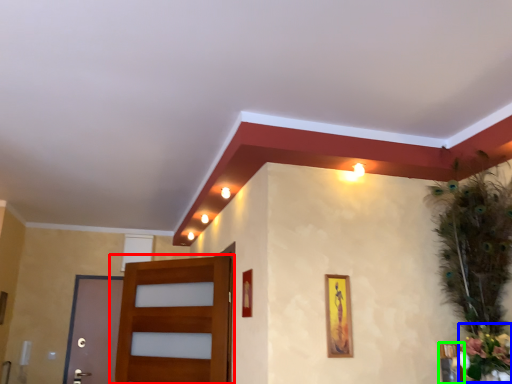
Question: Which is nearer to the door (highlighted by a red box)? flower (highlighted by a blue box) or picture frame (highlighted by a green box).

Choices:
 (A) flower
 (B) picture frame

Answer: (B)